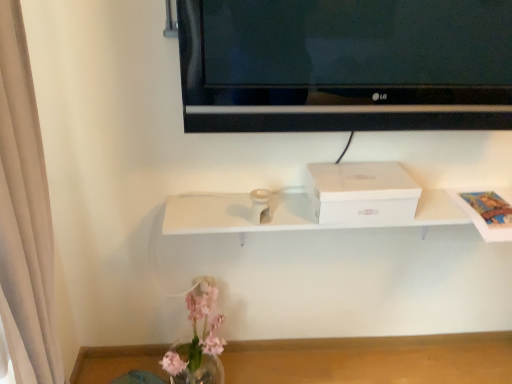
Question: From their relative heights in the image, would you say transparent glass vase at lower center is taller or shorter than translucent glass vase at lower left?

Choices:
 (A) short
 (B) tall

Answer: (A)

Question: Considering the positions of transparent glass vase at lower center and translucent glass vase at lower left in the image, is transparent glass vase at lower center wider or thinner than translucent glass vase at lower left?

Choices:
 (A) thin
 (B) wide

Answer: (B)

Question: Which object is the farthest from the black glossy tv at upper center?

Choices:
 (A) white cardboard box at center
 (B) translucent glass vase at lower left
 (C) transparent glass vase at lower center

Answer: (C)

Question: Estimate the real-world distances between objects in this image. Which object is closer to the transparent glass vase at lower center?

Choices:
 (A) translucent glass vase at lower left
 (B) white cardboard box at center
 (C) black glossy tv at upper center

Answer: (A)